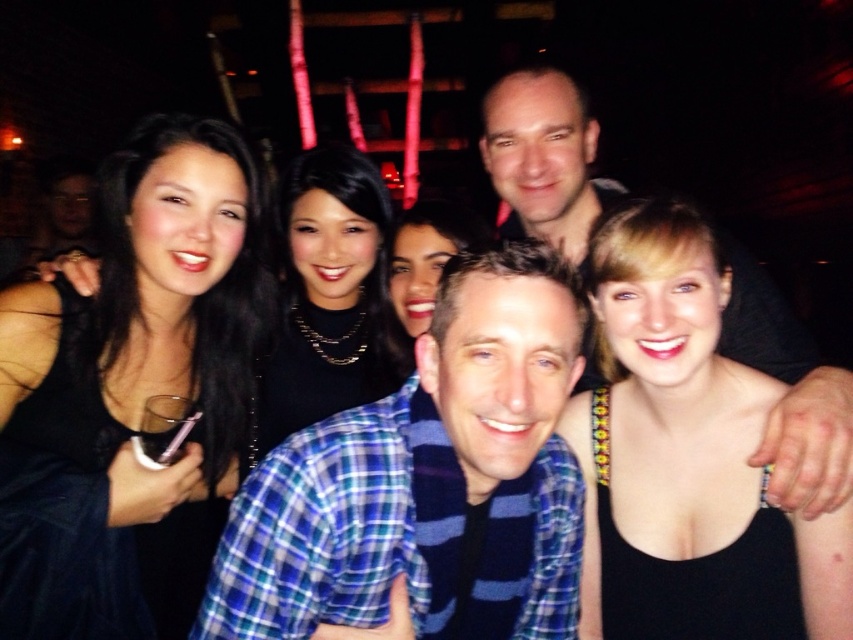
Does blue plaid shirt at center have a greater height compared to black matte necklace at center?

No.

Which is more to the right, blue plaid shirt at center or black matte necklace at center?

Positioned to the right is blue plaid shirt at center.

Locate an element on the screen. This screenshot has height=640, width=853. blue plaid shirt at center is located at coordinates (427, 477).

Which is above, blue plaid shirt at center or matte black shirt at upper center?

matte black shirt at upper center is above.

Does blue plaid shirt at center have a greater height compared to matte black shirt at upper center?

Indeed, blue plaid shirt at center has a greater height compared to matte black shirt at upper center.

Who is more forward, (426, 419) or (485, 168)?

Positioned in front is point (426, 419).

Where is `blue plaid shirt at center`? blue plaid shirt at center is located at coordinates (427, 477).

Does blue plaid shirt at center appear under black satin dress at upper left?

Yes, blue plaid shirt at center is below black satin dress at upper left.

Image resolution: width=853 pixels, height=640 pixels. Describe the element at coordinates (427, 477) in the screenshot. I see `blue plaid shirt at center` at that location.

The image size is (853, 640). In order to click on blue plaid shirt at center in this screenshot , I will do `click(427, 477)`.